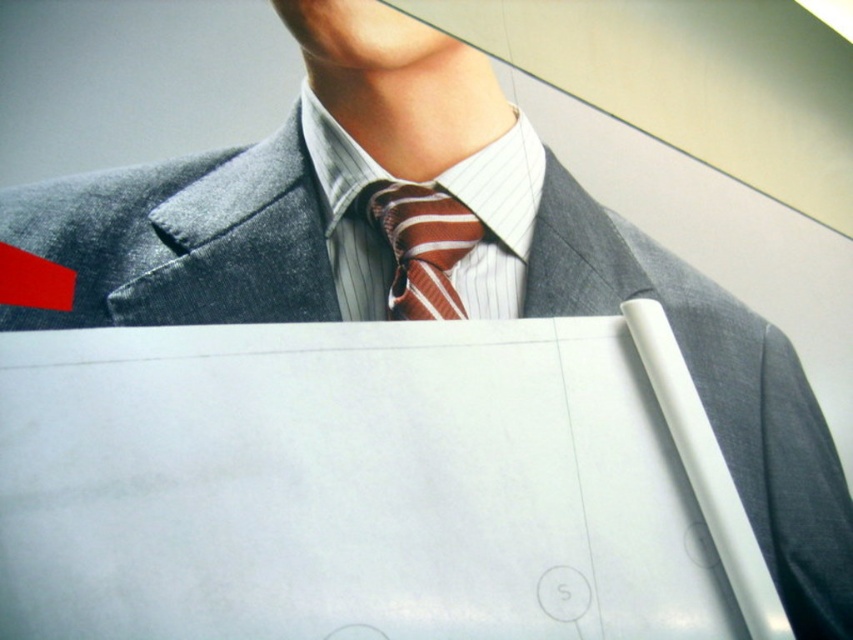
Question: Does white paper at center appear on the left side of striped silk tie at center?

Choices:
 (A) no
 (B) yes

Answer: (A)

Question: Can you confirm if white paper at center is bigger than striped silk tie at center?

Choices:
 (A) yes
 (B) no

Answer: (A)

Question: Among these points, which one is farthest from the camera?

Choices:
 (A) (637, 566)
 (B) (469, 237)

Answer: (B)

Question: Which point is farther to the camera?

Choices:
 (A) (619, 636)
 (B) (379, 184)

Answer: (B)

Question: Is white paper at center positioned at the back of striped silk tie at center?

Choices:
 (A) no
 (B) yes

Answer: (A)

Question: Which point is closer to the camera taking this photo?

Choices:
 (A) (416, 232)
 (B) (229, 342)

Answer: (B)